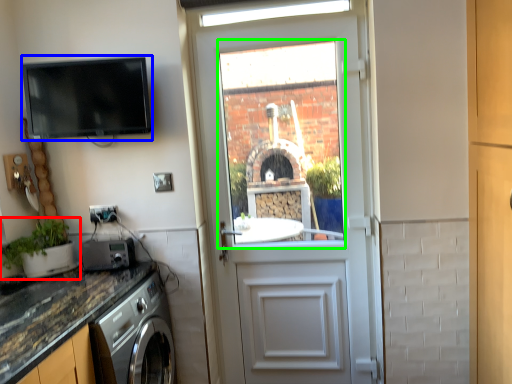
Question: Considering the real-world distances, which object is farthest from houseplant (highlighted by a red box)? appliance (highlighted by a blue box) or window (highlighted by a green box)?

Choices:
 (A) appliance
 (B) window

Answer: (B)